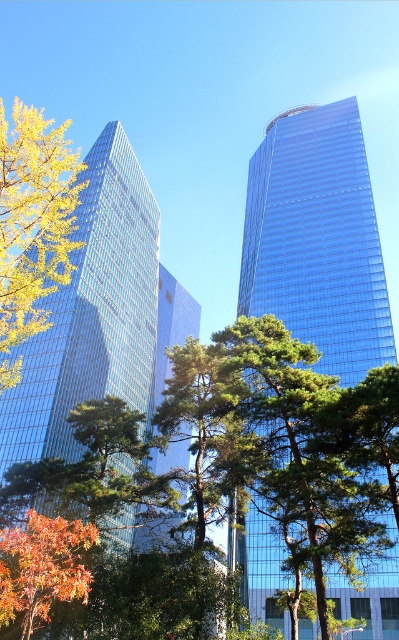
Is orange leafy tree at lower left wider than blue glass building at center?

No, orange leafy tree at lower left is not wider than blue glass building at center.

Between orange leafy tree at lower left and blue glass building at center, which one has less height?

orange leafy tree at lower left is shorter.

Is point (15, 602) positioned before point (187, 294)?

That is True.

Identify the location of orange leafy tree at lower left. The width and height of the screenshot is (399, 640). (43, 566).

Can you confirm if blue glassy skyscraper at center is positioned to the left of shiny glass skyscraper at left?

In fact, blue glassy skyscraper at center is to the right of shiny glass skyscraper at left.

Which is more to the right, blue glassy skyscraper at center or shiny glass skyscraper at left?

Positioned to the right is blue glassy skyscraper at center.

Which is behind, point (266, 304) or point (61, 324)?

The point (266, 304) is more distant.

You are a GUI agent. You are given a task and a screenshot of the screen. Output one action in this format:
    pyautogui.click(x=<x>, y=<y>)
    Task: Click on the blue glassy skyscraper at center
    This screenshot has height=640, width=399.
    Given the screenshot: What is the action you would take?
    pyautogui.click(x=318, y=240)

From the picture: Is yellow leafy tree at left wider than blue glass building at center?

Indeed, yellow leafy tree at left has a greater width compared to blue glass building at center.

How much distance is there between yellow leafy tree at left and blue glass building at center?

They are 124.36 feet apart.

Does point (47, 163) lie in front of point (171, 298)?

Yes.

Identify the location of yellow leafy tree at left. (33, 225).